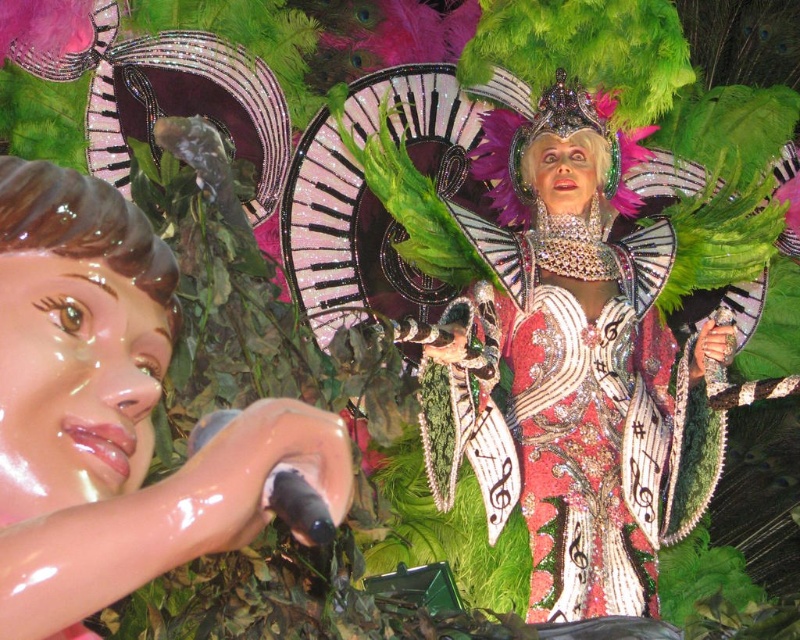
Is matte plastic doll at left wider than shiny sequined dress at center?

No, matte plastic doll at left is not wider than shiny sequined dress at center.

Between matte plastic doll at left and shiny sequined dress at center, which one appears on the right side from the viewer's perspective?

Positioned to the right is shiny sequined dress at center.

Who is more distant from viewer, (x=100, y=579) or (x=600, y=579)?

Positioned behind is point (x=600, y=579).

This screenshot has width=800, height=640. Identify the location of matte plastic doll at left. (112, 412).